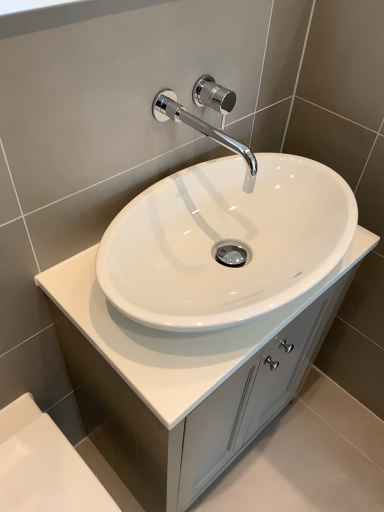
Image resolution: width=384 pixels, height=512 pixels. Find the location of `empty space that is ontop of white glossy bath at lower left`. empty space that is ontop of white glossy bath at lower left is located at coordinates (36, 469).